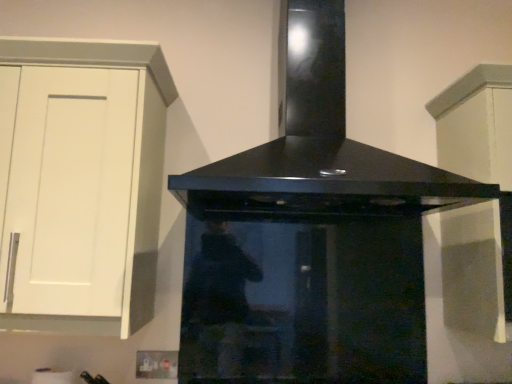
Where is `white matte cabinet at upper right, which is counted as the second cabinetry, starting from the left`? This screenshot has width=512, height=384. white matte cabinet at upper right, which is counted as the second cabinetry, starting from the left is located at coordinates (482, 157).

In order to click on black glossy range hood at center in this screenshot , I will do `click(330, 246)`.

In the image, is black glossy range hood at center positioned in front of or behind white matte cabinet at left, placed as the second cabinetry when sorted from right to left?

black glossy range hood at center is positioned closer to the viewer than white matte cabinet at left, placed as the second cabinetry when sorted from right to left.

Is black glossy range hood at center touching white matte cabinet at left, placed as the second cabinetry when sorted from right to left?

No, black glossy range hood at center is not making contact with white matte cabinet at left, placed as the second cabinetry when sorted from right to left.

How far apart are black glossy range hood at center and white matte cabinet at left, arranged as the first cabinetry when viewed from the left?

black glossy range hood at center and white matte cabinet at left, arranged as the first cabinetry when viewed from the left, are 21.48 inches apart.

From a real-world perspective, is black glossy range hood at center physically located above or below white matte cabinet at left, arranged as the first cabinetry when viewed from the left?

In terms of real-world spatial position, black glossy range hood at center is above white matte cabinet at left, arranged as the first cabinetry when viewed from the left.

Is black glossy range hood at center oriented away from white matte cabinet at upper right, the 1th cabinetry viewed from the right?

black glossy range hood at center does not have its back to white matte cabinet at upper right, the 1th cabinetry viewed from the right.

Between black glossy range hood at center and white matte cabinet at upper right, the 1th cabinetry viewed from the right, which one has smaller size?

white matte cabinet at upper right, the 1th cabinetry viewed from the right.

Is point (490, 272) farther from viewer compared to point (504, 114)?

That is True.

The width and height of the screenshot is (512, 384). I want to click on cabinetry on the right side of black glossy range hood at center, so click(x=482, y=157).

Is point (487, 72) farther from viewer compared to point (361, 332)?

That is False.

Are white matte cabinet at upper right, the 1th cabinetry viewed from the right, and black glossy range hood at center located far from each other?

That's not correct — white matte cabinet at upper right, the 1th cabinetry viewed from the right, is a little close to black glossy range hood at center.

Does white matte cabinet at upper right, the 1th cabinetry viewed from the right, appear on the right side of black glossy range hood at center?

Yes.

Where is `home appliance that is above the white matte cabinet at upper right, the 1th cabinetry viewed from the right (from a real-world perspective)`? This screenshot has height=384, width=512. home appliance that is above the white matte cabinet at upper right, the 1th cabinetry viewed from the right (from a real-world perspective) is located at coordinates (330, 246).

Considering the relative positions of white matte cabinet at left, placed as the second cabinetry when sorted from right to left, and black glossy range hood at center in the image provided, is white matte cabinet at left, placed as the second cabinetry when sorted from right to left, to the left of black glossy range hood at center from the viewer's perspective?

Correct, you'll find white matte cabinet at left, placed as the second cabinetry when sorted from right to left, to the left of black glossy range hood at center.

Is white matte cabinet at left, arranged as the first cabinetry when viewed from the left, situated inside black glossy range hood at center or outside?

white matte cabinet at left, arranged as the first cabinetry when viewed from the left, lies outside black glossy range hood at center.

Is the depth of white matte cabinet at left, placed as the second cabinetry when sorted from right to left, greater than that of black glossy range hood at center?

Yes, it is.

Looking at this image, from the image's perspective, is white matte cabinet at left, arranged as the first cabinetry when viewed from the left, above black glossy range hood at center?

Actually, white matte cabinet at left, arranged as the first cabinetry when viewed from the left, appears below black glossy range hood at center in the image.

Looking at their sizes, would you say white matte cabinet at left, arranged as the first cabinetry when viewed from the left, is wider or thinner than white matte cabinet at upper right, which is counted as the second cabinetry, starting from the left?

In the image, white matte cabinet at left, arranged as the first cabinetry when viewed from the left, appears to be more narrow than white matte cabinet at upper right, which is counted as the second cabinetry, starting from the left.

Who is shorter, white matte cabinet at left, arranged as the first cabinetry when viewed from the left, or white matte cabinet at upper right, which is counted as the second cabinetry, starting from the left?

Standing shorter between the two is white matte cabinet at left, arranged as the first cabinetry when viewed from the left.

Between point (40, 60) and point (501, 103), which one is positioned behind?

Point (501, 103)

Considering the relative positions of white matte cabinet at left, arranged as the first cabinetry when viewed from the left, and white matte cabinet at upper right, which is counted as the second cabinetry, starting from the left, in the image provided, is white matte cabinet at left, arranged as the first cabinetry when viewed from the left, in front of white matte cabinet at upper right, which is counted as the second cabinetry, starting from the left,?

Yes, it is.

Are white matte cabinet at upper right, the 1th cabinetry viewed from the right, and white matte cabinet at left, arranged as the first cabinetry when viewed from the left, making contact?

No, white matte cabinet at upper right, the 1th cabinetry viewed from the right, is not making contact with white matte cabinet at left, arranged as the first cabinetry when viewed from the left.

Is white matte cabinet at upper right, which is counted as the second cabinetry, starting from the left, situated inside white matte cabinet at left, arranged as the first cabinetry when viewed from the left, or outside?

white matte cabinet at upper right, which is counted as the second cabinetry, starting from the left, is located beyond the bounds of white matte cabinet at left, arranged as the first cabinetry when viewed from the left.

Does point (483, 95) come farther from viewer compared to point (134, 251)?

Yes, it is.

Is white matte cabinet at upper right, which is counted as the second cabinetry, starting from the left, to the right of white matte cabinet at left, placed as the second cabinetry when sorted from right to left, from the viewer's perspective?

Yes, white matte cabinet at upper right, which is counted as the second cabinetry, starting from the left, is to the right of white matte cabinet at left, placed as the second cabinetry when sorted from right to left.

Locate an element on the screen. the 1st cabinetry behind when counting from the black glossy range hood at center is located at coordinates (134, 150).

Locate an element on the screen. The width and height of the screenshot is (512, 384). cabinetry that is the 2nd object directly below the black glossy range hood at center (from a real-world perspective) is located at coordinates (482, 157).

Based on their spatial positions, is white matte cabinet at left, arranged as the first cabinetry when viewed from the left, or black glossy range hood at center further from white matte cabinet at upper right, the 1th cabinetry viewed from the right?

The object further to white matte cabinet at upper right, the 1th cabinetry viewed from the right, is white matte cabinet at left, arranged as the first cabinetry when viewed from the left.

When comparing their distances from white matte cabinet at left, placed as the second cabinetry when sorted from right to left, does black glossy range hood at center or white matte cabinet at upper right, which is counted as the second cabinetry, starting from the left, seem further?

white matte cabinet at upper right, which is counted as the second cabinetry, starting from the left.

Based on their spatial positions, is black glossy range hood at center or white matte cabinet at left, placed as the second cabinetry when sorted from right to left, further from white matte cabinet at upper right, the 1th cabinetry viewed from the right?

Among the two, white matte cabinet at left, placed as the second cabinetry when sorted from right to left, is located further to white matte cabinet at upper right, the 1th cabinetry viewed from the right.

When comparing their distances from black glossy range hood at center, does white matte cabinet at upper right, which is counted as the second cabinetry, starting from the left, or white matte cabinet at left, arranged as the first cabinetry when viewed from the left, seem closer?

Based on the image, white matte cabinet at upper right, which is counted as the second cabinetry, starting from the left, appears to be nearer to black glossy range hood at center.

Which object lies further to the anchor point white matte cabinet at left, arranged as the first cabinetry when viewed from the left, white matte cabinet at upper right, the 1th cabinetry viewed from the right, or black glossy range hood at center?

white matte cabinet at upper right, the 1th cabinetry viewed from the right, is positioned further to the anchor white matte cabinet at left, arranged as the first cabinetry when viewed from the left.

Based on their spatial positions, is white matte cabinet at left, placed as the second cabinetry when sorted from right to left, or white matte cabinet at upper right, the 1th cabinetry viewed from the right, closer to black glossy range hood at center?

Based on the image, white matte cabinet at upper right, the 1th cabinetry viewed from the right, appears to be nearer to black glossy range hood at center.

At what (x,y) coordinates should I click in order to perform the action: click on home appliance between white matte cabinet at left, arranged as the first cabinetry when viewed from the left, and white matte cabinet at upper right, which is counted as the second cabinetry, starting from the left. Please return your answer as a coordinate pair (x, y). The width and height of the screenshot is (512, 384). Looking at the image, I should click on point(330,246).